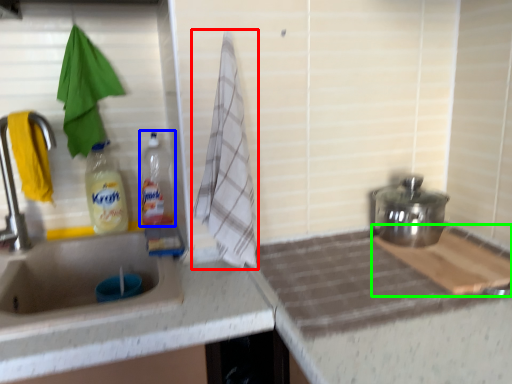
Question: Based on their relative distances, which object is farther from beach towel (highlighted by a red box)? Choose from bottle (highlighted by a blue box) and cutting board (highlighted by a green box).

Choices:
 (A) bottle
 (B) cutting board

Answer: (B)